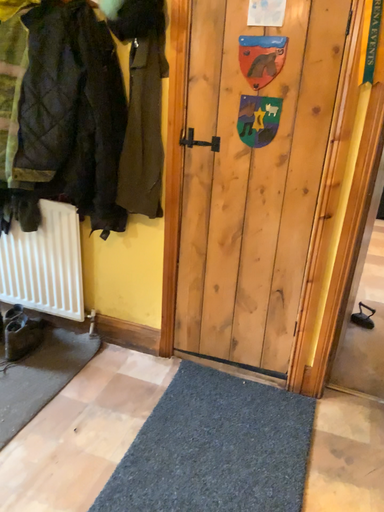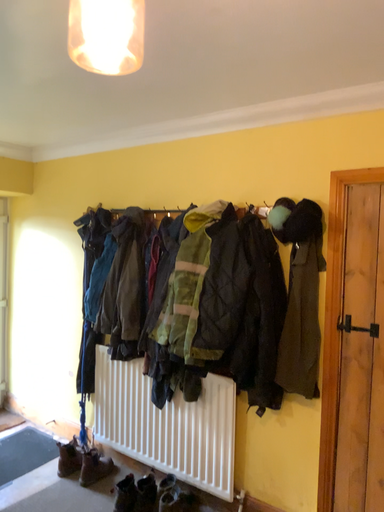
Question: How did the camera likely rotate when shooting the video?

Choices:
 (A) rotated right
 (B) rotated left

Answer: (B)